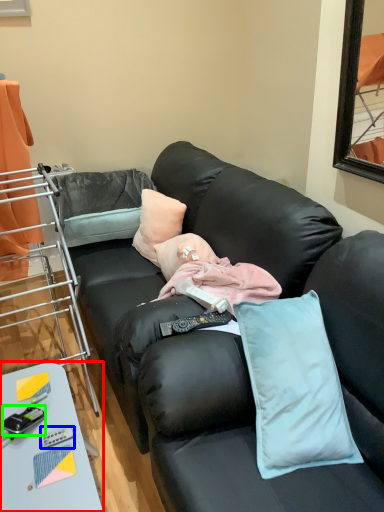
Question: Which object is positioned closest to table (highlighted by a red box)? Select from equipment (highlighted by a blue box) and equipment (highlighted by a green box).

Choices:
 (A) equipment
 (B) equipment

Answer: (B)